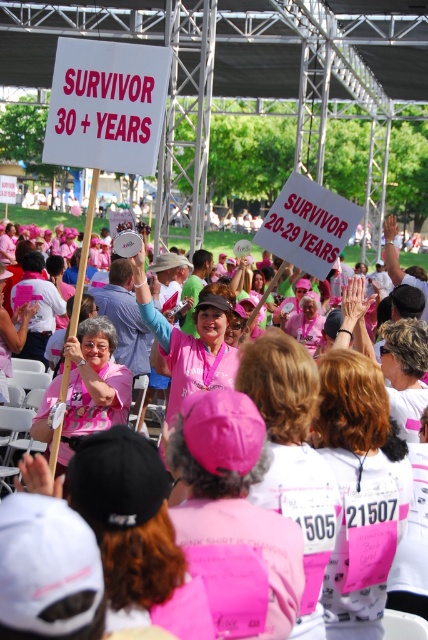
You are a photographer at the breast cancer awareness event. You want to capture a photo of the pink fabric crowd at center from the best angle. Where should you position yourself relative to the large metal framework to ensure they are in the center of your shot?

To center the pink fabric crowd at center in your photo, position yourself directly in line with the coordinates provided, ensuring the crowd is framed at the center point of your viewfinder.